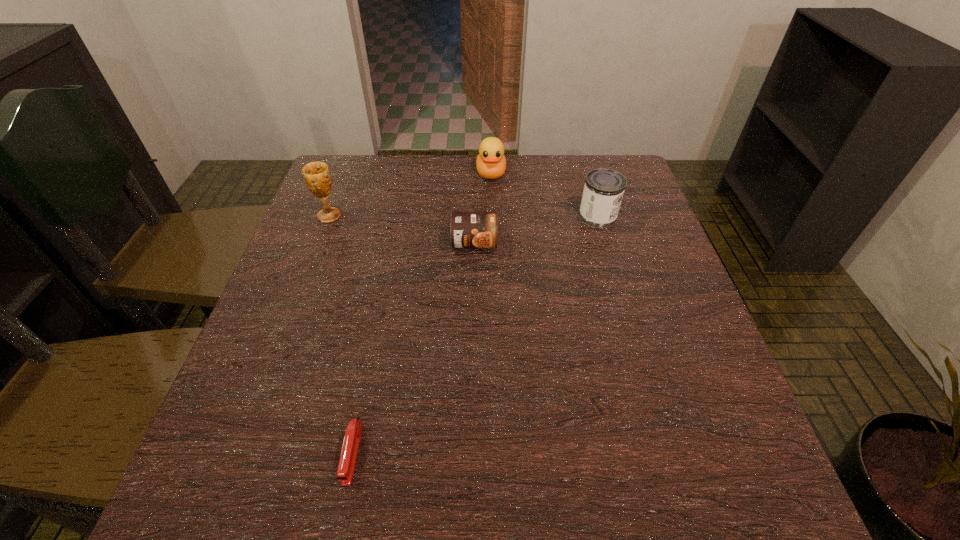
I want to click on vacant area that lies between the rightmost object and the shortest object, so click(475, 335).

I want to click on the fourth closest object to the leftmost object, so (x=604, y=188).

This screenshot has width=960, height=540. I want to click on object that can be found as the second closest to the nearer can, so click(x=604, y=188).

Locate an element on the screen. free spot that satisfies the following two spatial constraints: 1. on the face of the duckling; 2. on the left side of the farther can is located at coordinates (492, 217).